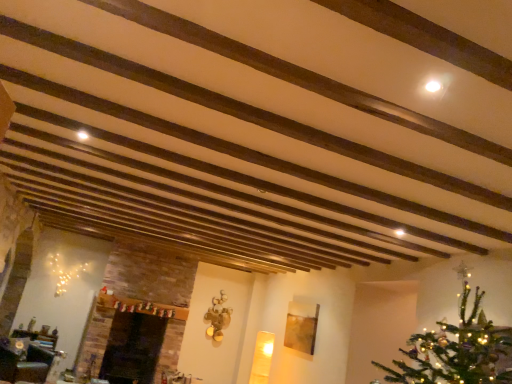
Identify the location of black glossy fireplace at lower left. (133, 348).

Describe the element at coordinates (133, 348) in the screenshot. The image size is (512, 384). I see `black glossy fireplace at lower left` at that location.

This screenshot has height=384, width=512. What do you see at coordinates (25, 361) in the screenshot? I see `wooden coffee table at lower left` at bounding box center [25, 361].

Where is `wooden coffee table at lower left`? This screenshot has width=512, height=384. wooden coffee table at lower left is located at coordinates (25, 361).

The image size is (512, 384). In order to click on black glossy fireplace at lower left in this screenshot , I will do `click(133, 348)`.

In the image, is wooden coffee table at lower left on the left side or the right side of black glossy fireplace at lower left?

In the image, wooden coffee table at lower left appears on the left side of black glossy fireplace at lower left.

In the image, is wooden coffee table at lower left positioned in front of or behind black glossy fireplace at lower left?

Visually, wooden coffee table at lower left is located in front of black glossy fireplace at lower left.

Which is less distant, (5, 365) or (165, 322)?

The point (5, 365) is in front.

From the image's perspective, is wooden coffee table at lower left on top of black glossy fireplace at lower left?

Yes.

From a real-world perspective, which object rests below the other?

wooden coffee table at lower left.

Which object is thinner, wooden coffee table at lower left or black glossy fireplace at lower left?

Thinner between the two is wooden coffee table at lower left.

Considering the sizes of wooden coffee table at lower left and black glossy fireplace at lower left in the image, is wooden coffee table at lower left taller or shorter than black glossy fireplace at lower left?

wooden coffee table at lower left is shorter than black glossy fireplace at lower left.

Who is smaller, wooden coffee table at lower left or black glossy fireplace at lower left?

Smaller between the two is wooden coffee table at lower left.

Could black glossy fireplace at lower left be considered to be inside wooden coffee table at lower left?

That's incorrect, black glossy fireplace at lower left is not inside wooden coffee table at lower left.

Can you see wooden coffee table at lower left touching black glossy fireplace at lower left?

wooden coffee table at lower left is not next to black glossy fireplace at lower left, and they're not touching.

Could you tell me if wooden coffee table at lower left is turned towards black glossy fireplace at lower left?

No, wooden coffee table at lower left is not aimed at black glossy fireplace at lower left.

Measure the distance between wooden coffee table at lower left and black glossy fireplace at lower left.

A distance of 3.38 feet exists between wooden coffee table at lower left and black glossy fireplace at lower left.

I want to click on fireplace behind the wooden coffee table at lower left, so click(x=133, y=348).

Which is more to the right, black glossy fireplace at lower left or wooden coffee table at lower left?

black glossy fireplace at lower left.

Looking at this image, which object is closer to the camera taking this photo, black glossy fireplace at lower left or wooden coffee table at lower left?

Positioned in front is wooden coffee table at lower left.

Does point (135, 365) appear closer or farther from the camera than point (36, 378)?

Point (135, 365) is positioned farther from the camera compared to point (36, 378).

From the image's perspective, is black glossy fireplace at lower left located above or below wooden coffee table at lower left?

black glossy fireplace at lower left is below wooden coffee table at lower left.

From a real-world perspective, is black glossy fireplace at lower left physically below wooden coffee table at lower left?

No, from a real-world perspective, black glossy fireplace at lower left is not beneath wooden coffee table at lower left.

Considering the sizes of objects black glossy fireplace at lower left and wooden coffee table at lower left in the image provided, who is thinner, black glossy fireplace at lower left or wooden coffee table at lower left?

wooden coffee table at lower left is thinner.

Which of these two, black glossy fireplace at lower left or wooden coffee table at lower left, stands taller?

With more height is black glossy fireplace at lower left.

Considering the sizes of objects black glossy fireplace at lower left and wooden coffee table at lower left in the image provided, who is smaller, black glossy fireplace at lower left or wooden coffee table at lower left?

wooden coffee table at lower left is smaller.

Is wooden coffee table at lower left a part of black glossy fireplace at lower left?

No, wooden coffee table at lower left is not a part of black glossy fireplace at lower left.

Based on the photo, is black glossy fireplace at lower left placed right next to wooden coffee table at lower left?

They are not placed beside each other.

Does black glossy fireplace at lower left turn towards wooden coffee table at lower left?

No.

How many degrees apart are the facing directions of black glossy fireplace at lower left and wooden coffee table at lower left?

The angular difference between black glossy fireplace at lower left and wooden coffee table at lower left is 1.79 degrees.

At what (x,y) coordinates should I click in order to perform the action: click on furniture above the black glossy fireplace at lower left (from the image's perspective). Please return your answer as a coordinate pair (x, y). Looking at the image, I should click on (25, 361).

At what (x,y) coordinates should I click in order to perform the action: click on furniture above the black glossy fireplace at lower left (from the image's perspective). Please return your answer as a coordinate pair (x, y). This screenshot has width=512, height=384. Looking at the image, I should click on (25, 361).

Identify the location of furniture directly beneath the black glossy fireplace at lower left (from a real-world perspective). The width and height of the screenshot is (512, 384). (25, 361).